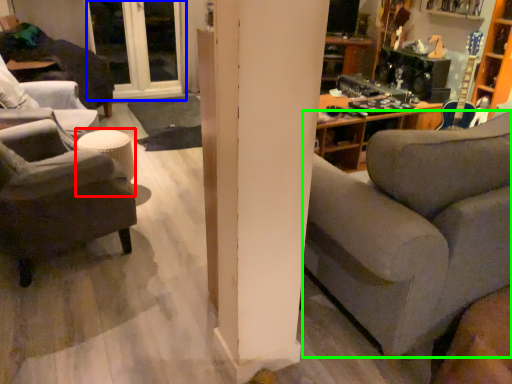
Question: Considering the real-world distances, which object is farthest from stool (highlighted by a red box)? window (highlighted by a blue box) or studio couch (highlighted by a green box)?

Choices:
 (A) window
 (B) studio couch

Answer: (A)